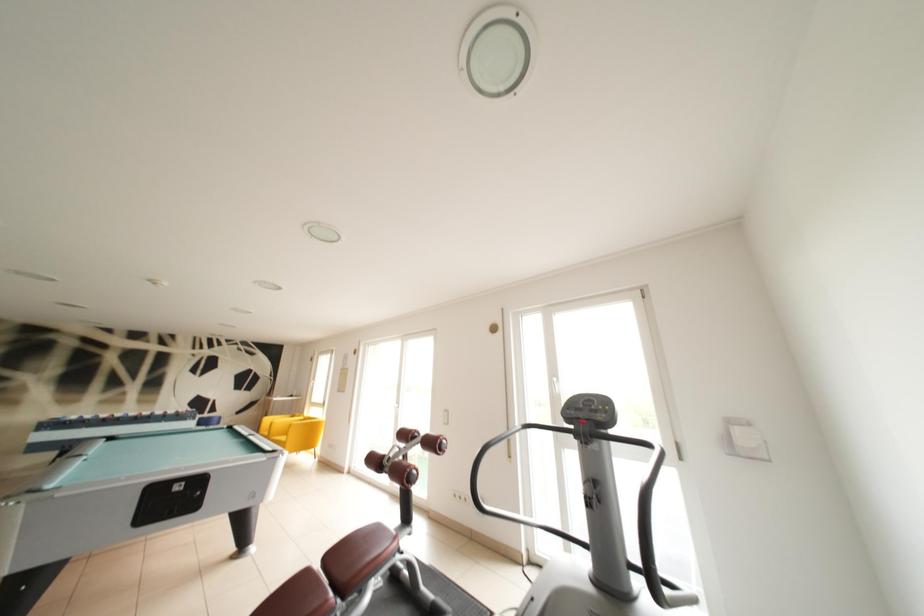
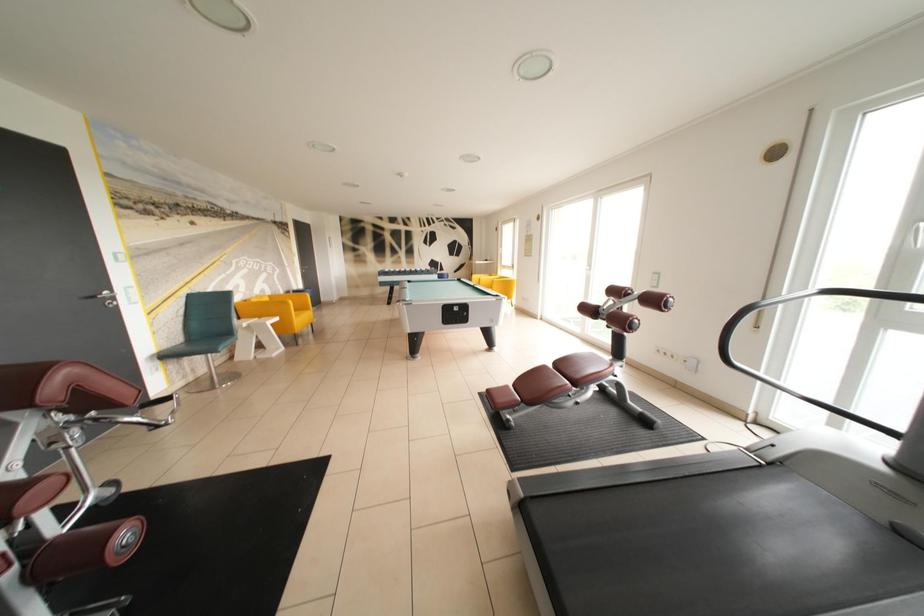
The first image is from the beginning of the video and the second image is from the end. How did the camera likely rotate when shooting the video?

The rotation direction of the camera is left-down.